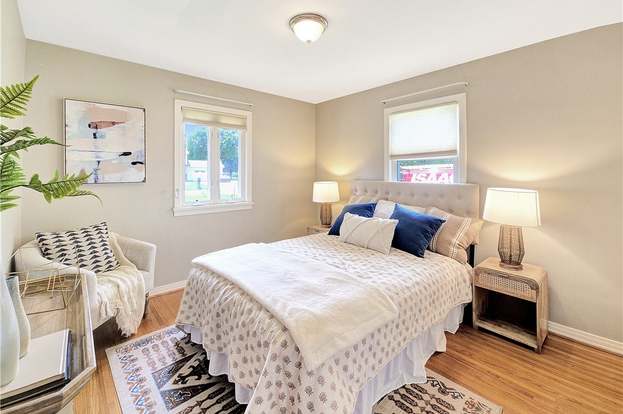
Where is `pillow`? Image resolution: width=623 pixels, height=414 pixels. pillow is located at coordinates (450, 228), (409, 207), (406, 226), (366, 226), (387, 209), (363, 208), (78, 253).